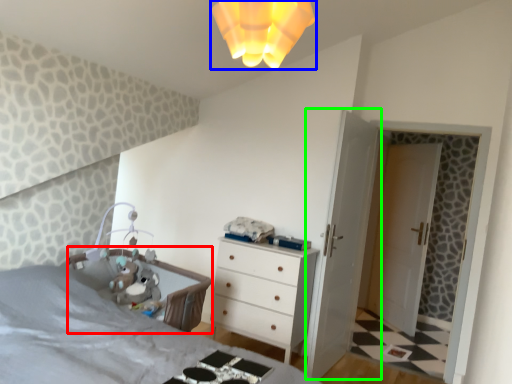
Question: Based on their relative distances, which object is farther from infant bed (highlighted by a red box)? Choose from light fixture (highlighted by a blue box) and door (highlighted by a green box).

Choices:
 (A) light fixture
 (B) door

Answer: (A)